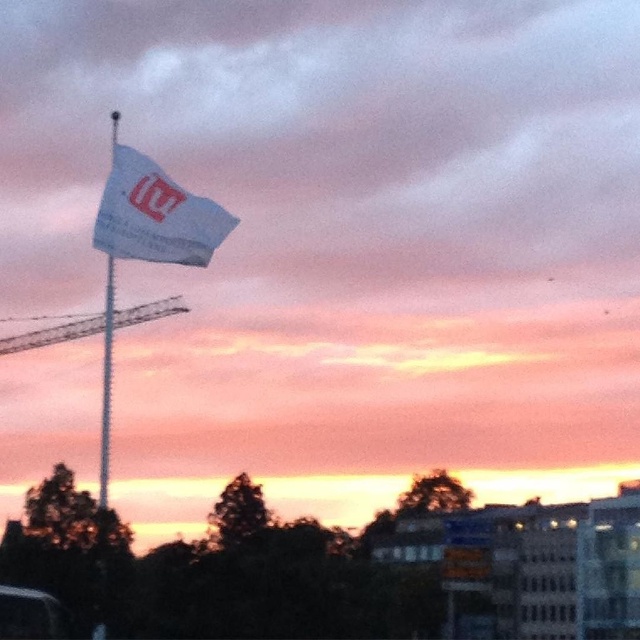
You are designing a banner for an event and want to ensure it is proportionate to the flagpole. Given that the white fabric flag at upper center and the white fabric flagpole at upper left are part of the design, which one has a greater width?

The white fabric flag at upper center has a greater width than the white fabric flagpole at upper left according to the description.

You are standing in the sunset scene looking at the flag. There are two points marked in the image. Which point is closer to you, point (x=36, y=340) or point (x=112, y=284)?

Point (x=112, y=284) is closer to you because it is in front of point (x=36, y=340) according to their spatial arrangement.